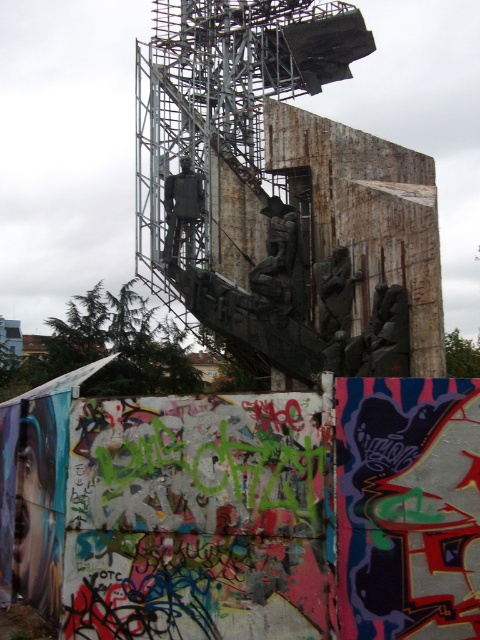
Question: Is the position of dark gray stone statue at center more distant than that of rustic stone statue at center?

Choices:
 (A) yes
 (B) no

Answer: (A)

Question: Which point is farther to the camera?

Choices:
 (A) rusty metal statue at center
 (B) shiny metallic statue at center
 (C) dark gray stone statue at center

Answer: (B)

Question: Among these objects, which one is nearest to the camera?

Choices:
 (A) shiny metallic statue at center
 (B) rusty metal statue at center
 (C) dark gray stone statue at center

Answer: (B)

Question: Is dark gray stone statue at center behind rusty metal statue at center?

Choices:
 (A) yes
 (B) no

Answer: (A)

Question: Which object appears closest to the camera in this image?

Choices:
 (A) dark gray stone statue at center
 (B) shiny metallic statue at center
 (C) rustic stone statue at center
 (D) rusty metal statue at center

Answer: (C)

Question: Considering the relative positions of shiny metallic statue at center and rusty metal statue at center in the image provided, where is shiny metallic statue at center located with respect to rusty metal statue at center?

Choices:
 (A) right
 (B) left

Answer: (B)